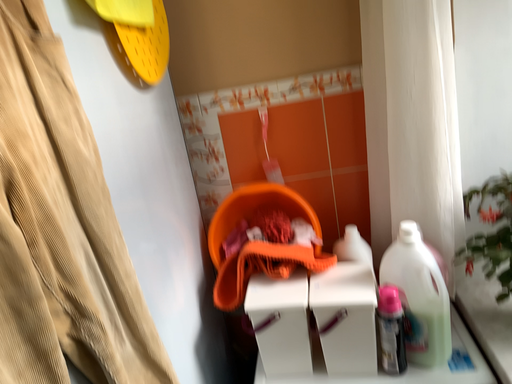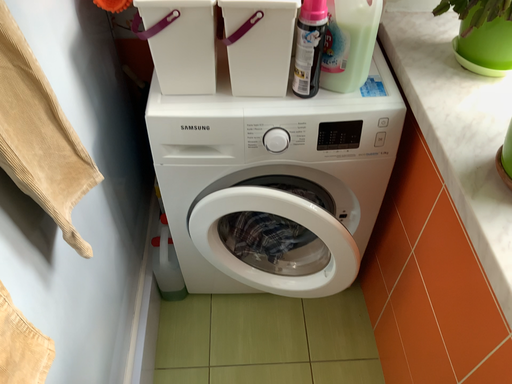
Question: Which way did the camera rotate in the video?

Choices:
 (A) rotated upward
 (B) rotated downward

Answer: (B)